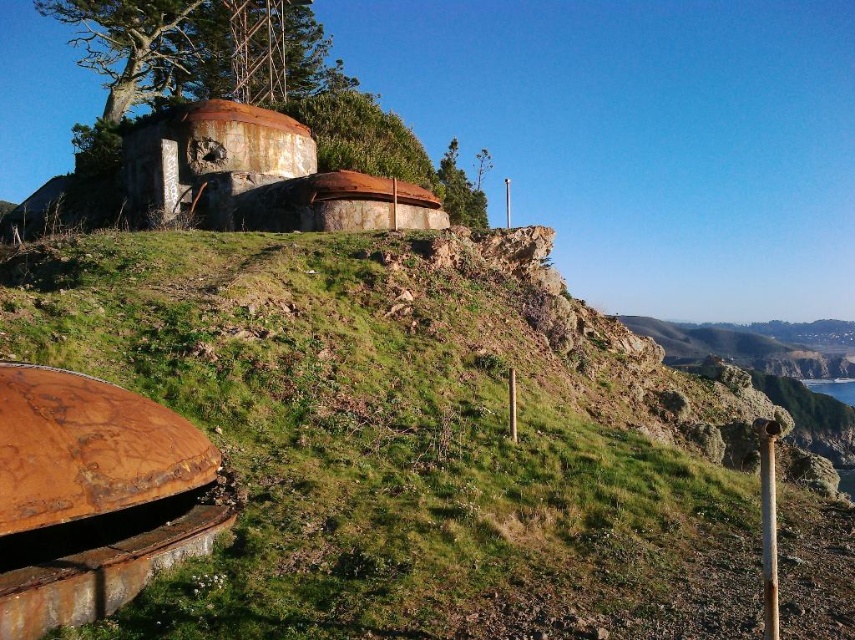
You are a hiker trying to navigate through the rugged coastal landscape. You notice two landmarks, the green leafy tree at upper left and the green leafy tree at upper center. Which tree should you use as a reference if you want to identify the taller landmark?

The green leafy tree at upper left is taller than the green leafy tree at upper center, so you should use the green leafy tree at upper left as your reference for the taller landmark.

Based on the photo, you are standing at the point marked by the coordinates point (x=407, y=442) in the image. Based on the scene description, what type of terrain are you currently standing on?

The point (x=407, y=442) indicates green grassy at center, so you are standing on green grassy terrain.